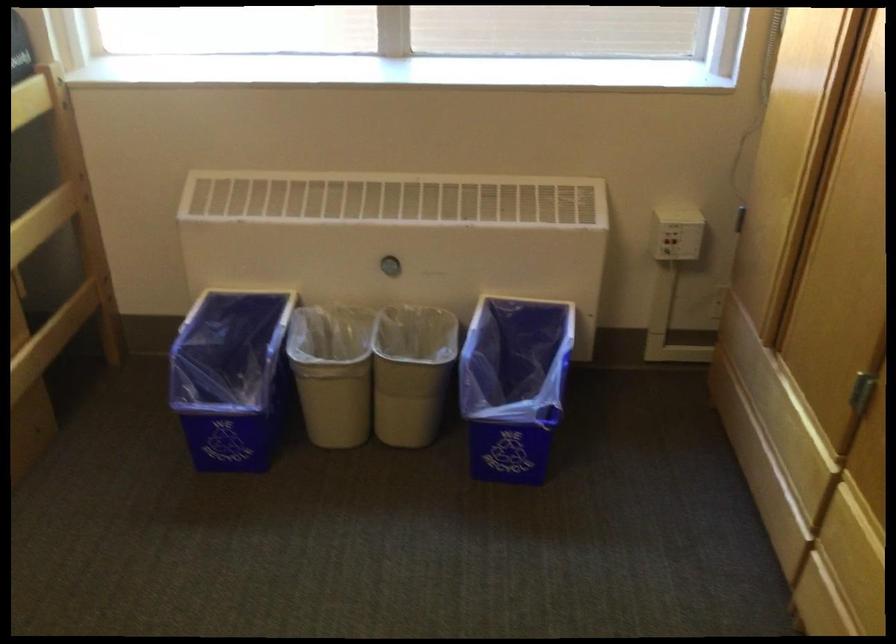
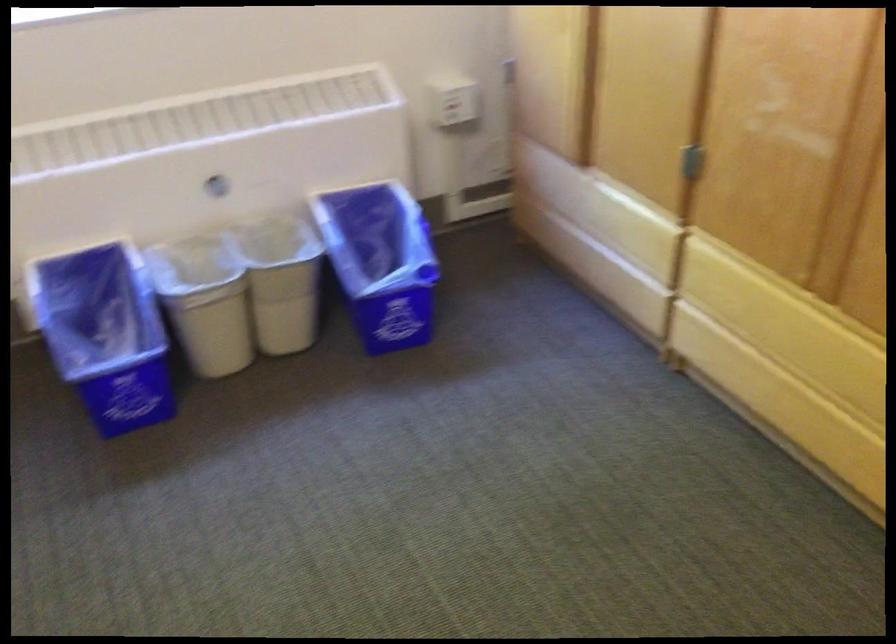
Locate, in the second image, the point that corresponds to [391,266] in the first image.

(218, 187)